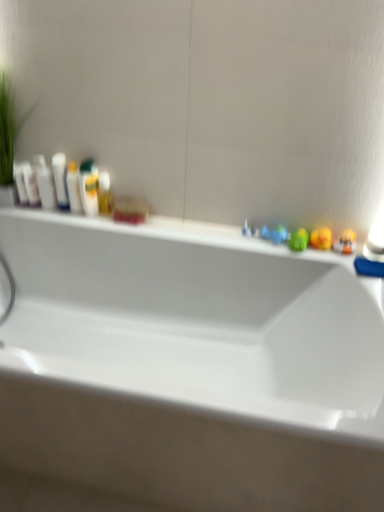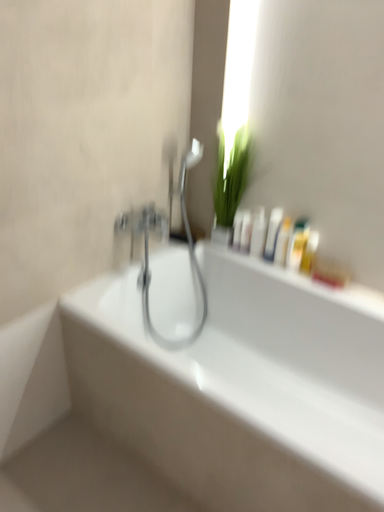
Question: Which way did the camera rotate in the video?

Choices:
 (A) rotated left
 (B) rotated right

Answer: (A)